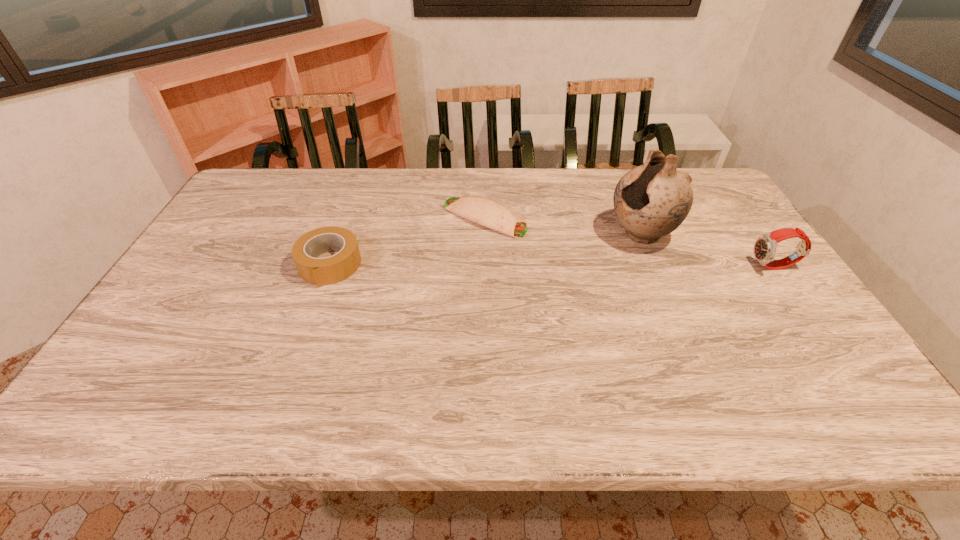
Where is `unoccupied area between the watch and the third tallest object`? This screenshot has height=540, width=960. unoccupied area between the watch and the third tallest object is located at coordinates (552, 266).

Where is `unoccupied area between the third tallest object and the third object from right to left`? This screenshot has width=960, height=540. unoccupied area between the third tallest object and the third object from right to left is located at coordinates (407, 241).

Find the location of a particular element. blank region between the third object from left to right and the third object from right to left is located at coordinates (563, 226).

Locate an element on the screen. Image resolution: width=960 pixels, height=540 pixels. blank region between the rightmost object and the tallest object is located at coordinates (708, 251).

Find the location of a particular element. empty space between the leftmost object and the rightmost object is located at coordinates tap(552, 266).

Identify the location of object that ranks as the second closest to the watch. (484, 211).

Where is `the third closest object to the third shortest object`? This screenshot has height=540, width=960. the third closest object to the third shortest object is located at coordinates (321, 271).

You are a GUI agent. You are given a task and a screenshot of the screen. Output one action in this format:
    pyautogui.click(x=<x>, y=<y>)
    Task: Click on the vacant region that satisfies the following two spatial constraints: 1. at the edge of the second shortest object; 2. on the face of the watch
    
    Given the screenshot: What is the action you would take?
    [329, 267]

You are a GUI agent. You are given a task and a screenshot of the screen. Output one action in this format:
    pyautogui.click(x=<x>, y=<y>)
    Task: Click on the free location that satisfies the following two spatial constraints: 1. on the front side of the watch; 2. on the face of the pottery
    The height and width of the screenshot is (540, 960).
    Given the screenshot: What is the action you would take?
    pyautogui.click(x=655, y=267)

Identify the location of free space that satisfies the following two spatial constraints: 1. on the front side of the watch; 2. on the face of the third object from right to left. The width and height of the screenshot is (960, 540). tap(485, 267).